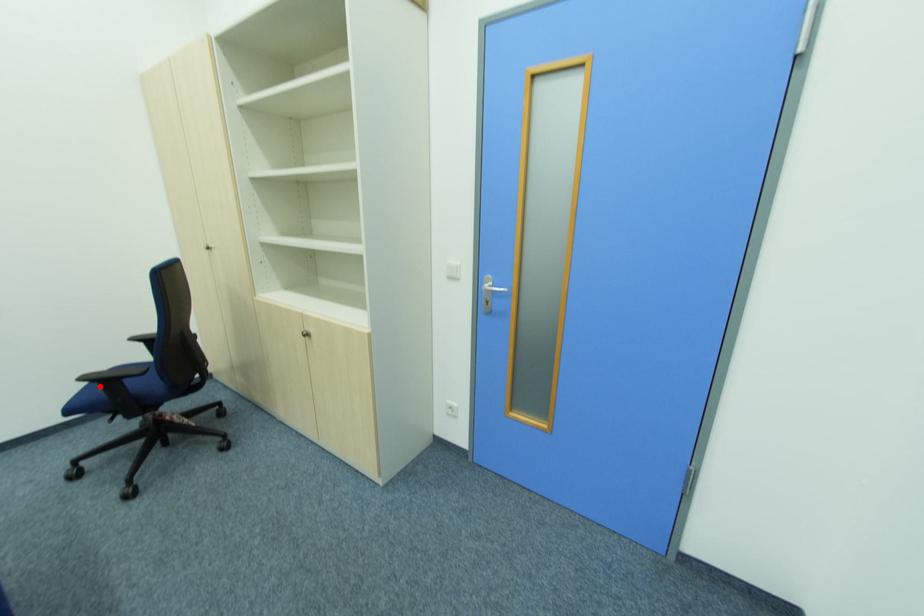
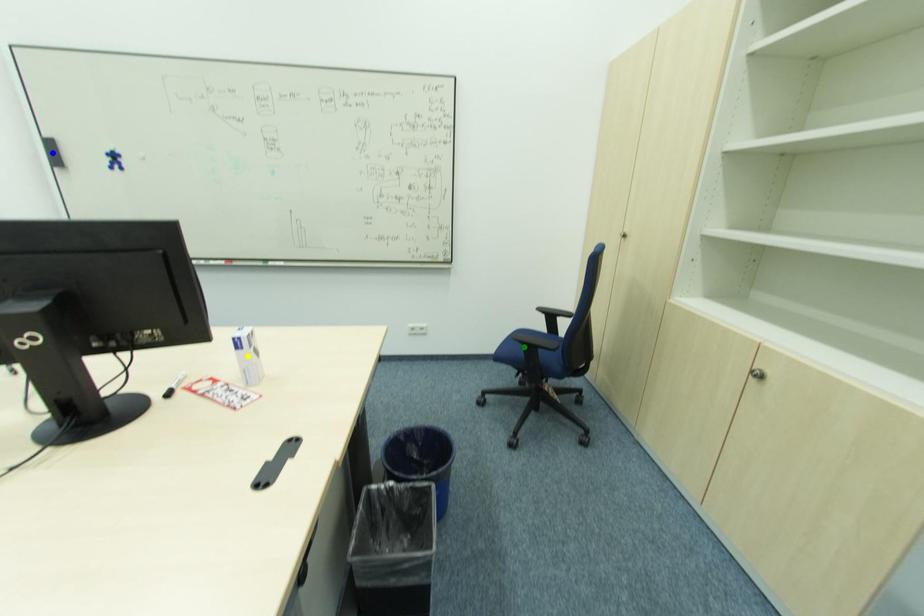
Question: I am providing you with two images of the same scene from different viewpoints. A red point is marked on the first image. You are given multiple points on the second image. Which mark in image 2 goes with the point in image 1?

Choices:
 (A) green point
 (B) blue point
 (C) yellow point

Answer: (A)